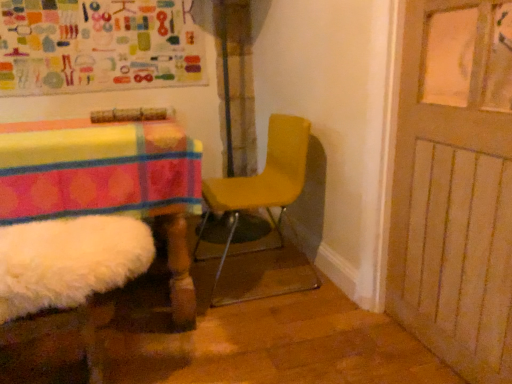
Locate an element on the screen. free space that is in between wooden door at right and yellow matte chair at center is located at coordinates (320, 326).